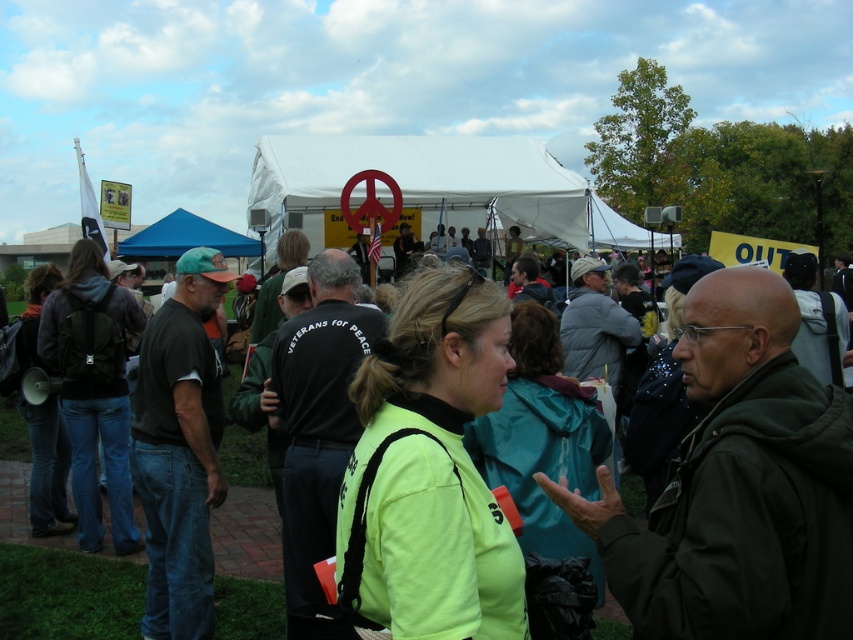
Question: Which of the following is the closest to the observer?

Choices:
 (A) white fabric tent at center
 (B) blue fabric canopy at center

Answer: (A)

Question: Is neon yellow jacket at center to the right of blue fabric canopy at center from the viewer's perspective?

Choices:
 (A) yes
 (B) no

Answer: (A)

Question: Which object is closer to the camera taking this photo?

Choices:
 (A) blue fabric canopy at center
 (B) white fabric tent at center
 (C) neon yellow jacket at center

Answer: (C)

Question: Considering the relative positions of white fabric tent at center and blue fabric canopy at center in the image provided, where is white fabric tent at center located with respect to blue fabric canopy at center?

Choices:
 (A) above
 (B) below

Answer: (A)

Question: Is neon yellow jacket at center positioned before blue fabric canopy at center?

Choices:
 (A) no
 (B) yes

Answer: (B)

Question: Estimate the real-world distances between objects in this image. Which object is closer to the neon yellow jacket at center?

Choices:
 (A) blue fabric canopy at center
 (B) white fabric tent at center

Answer: (A)